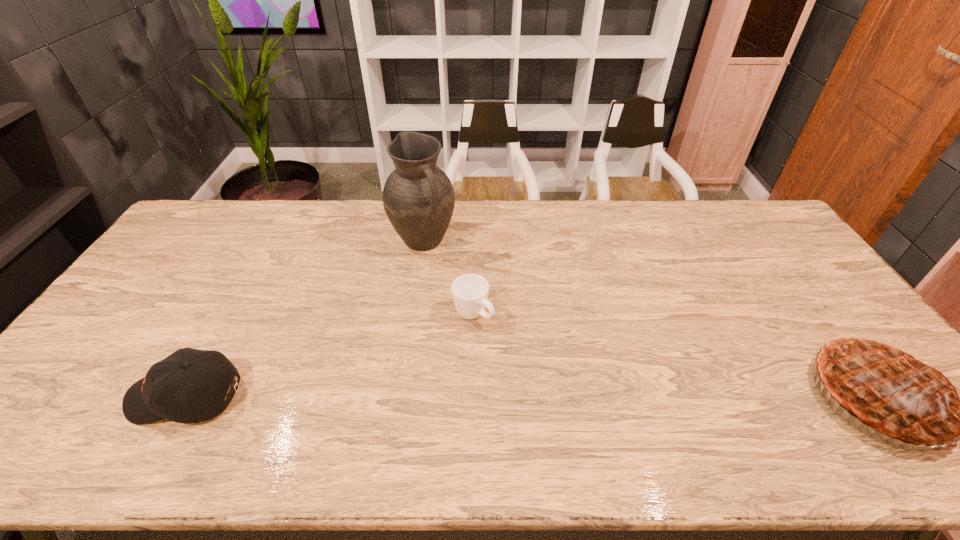
Locate an element on the screen. free space on the desktop that is between the second shortest object and the rightmost object and is positioned on the side of the pitcher with the handle is located at coordinates (543, 397).

At what (x,y) coordinates should I click in order to perform the action: click on free spot on the desktop that is between the baseball cap and the pie and is positioned with the handle on the side of the shortest object. Please return your answer as a coordinate pair (x, y). Looking at the image, I should click on pos(574,397).